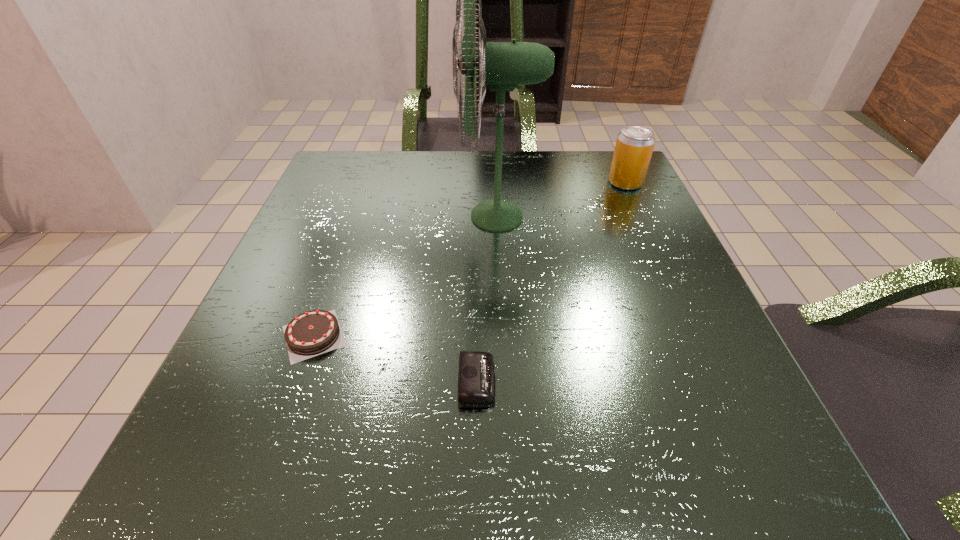
You are a GUI agent. You are given a task and a screenshot of the screen. Output one action in this format:
    pyautogui.click(x=<x>, y=<y>)
    Task: Click on the vacant space at the right edge of the desktop
    This screenshot has width=960, height=540.
    Given the screenshot: What is the action you would take?
    pyautogui.click(x=646, y=350)

Locate an element on the screen. This screenshot has width=960, height=540. free space at the far right corner of the desktop is located at coordinates (607, 180).

At what (x,y) coordinates should I click in order to perform the action: click on free space at the near right corner of the desktop. Please return your answer as a coordinate pair (x, y). This screenshot has height=540, width=960. Looking at the image, I should click on (757, 487).

At what (x,y) coordinates should I click in order to perform the action: click on vacant space that's between the second tallest object and the fan. Please return your answer as a coordinate pair (x, y). Looking at the image, I should click on (562, 199).

You are a GUI agent. You are given a task and a screenshot of the screen. Output one action in this format:
    pyautogui.click(x=<x>, y=<y>)
    Task: Click on the free space that is in between the fan and the third shortest object
    
    Given the screenshot: What is the action you would take?
    pyautogui.click(x=562, y=199)

At what (x,y) coordinates should I click in order to perform the action: click on vacant area that lies between the second shortest object and the tallest object. Please return your answer as a coordinate pair (x, y). The width and height of the screenshot is (960, 540). Looking at the image, I should click on (406, 276).

Find the location of a particular element. Image resolution: width=960 pixels, height=540 pixels. unoccupied area between the fan and the alarm clock is located at coordinates (488, 299).

Where is `vacant point located between the second tallest object and the leftmost object`? vacant point located between the second tallest object and the leftmost object is located at coordinates (469, 259).

Identify the location of vacant space that is in between the chocolate cake and the tallest object. (406, 276).

Identify the location of free point between the tallest object and the third shortest object. (562, 199).